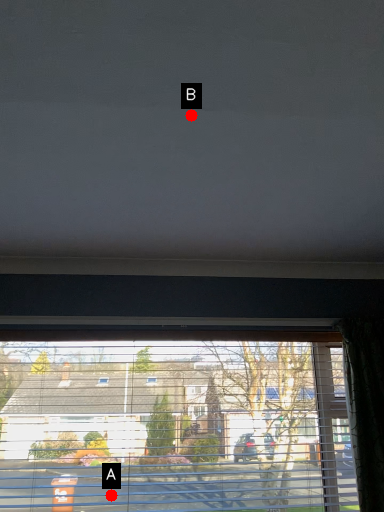
Question: Two points are circled on the image, labeled by A and B beside each circle. Which point is closer to the camera taking this photo?

Choices:
 (A) A is closer
 (B) B is closer

Answer: (B)